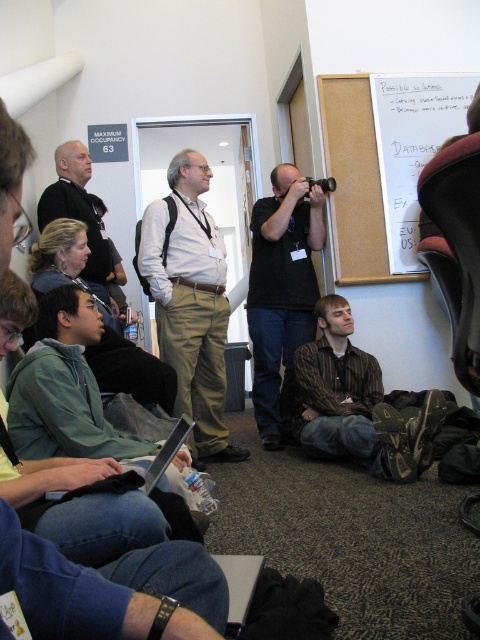
Measure the distance between point [328,125] and camera.

They are 3.48 meters apart.

Who is more forward, (x=333, y=172) or (x=156, y=467)?

Positioned in front is point (x=156, y=467).

Find the location of a particular element. whiteboard at upper right is located at coordinates coord(355,180).

Is point (412, 456) farther from viewer compared to point (359, 230)?

No, it is in front of (359, 230).

Find the location of a particular element. This screenshot has width=480, height=640. brown striped shirt at lower center is located at coordinates (357, 403).

Does point (44, 202) lie in front of point (310, 186)?

Yes, point (44, 202) is closer to viewer.

Which is below, matte black shirt at upper left or black plastic video camera at center?

matte black shirt at upper left is lower down.

Between point (64, 198) and point (322, 182), which one is positioned in front?

Positioned in front is point (64, 198).

Image resolution: width=480 pixels, height=640 pixels. In order to click on matte black shirt at upper left in this screenshot , I will do `click(80, 216)`.